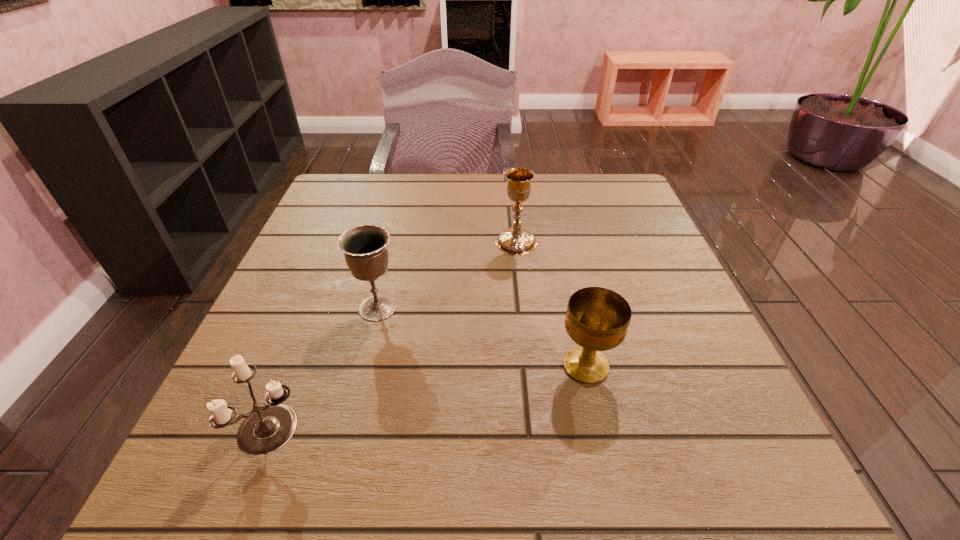
Where is `free location at the far right corner`? This screenshot has width=960, height=540. free location at the far right corner is located at coordinates coord(570,180).

At what (x,y) coordinates should I click in order to perform the action: click on vacant region at the near right corner of the desktop. Please return your answer as a coordinate pair (x, y). Looking at the image, I should click on (670, 460).

Where is `free spot between the farthest chalice and the second farthest object`? free spot between the farthest chalice and the second farthest object is located at coordinates (447, 275).

Identify the location of free area in between the candle holder and the third farthest object. This screenshot has width=960, height=540. (429, 397).

Locate an element on the screen. free point between the second object from right to left and the second nearest object is located at coordinates (551, 304).

Where is `free space between the second nearest object and the third object from right to left`? Image resolution: width=960 pixels, height=540 pixels. free space between the second nearest object and the third object from right to left is located at coordinates (482, 337).

This screenshot has width=960, height=540. I want to click on free space between the second object from right to left and the rightmost object, so click(551, 304).

Where is `empty location between the candle holder and the second farthest object`? empty location between the candle holder and the second farthest object is located at coordinates (324, 368).

Find the location of a particular element. Image resolution: width=960 pixels, height=540 pixels. vacant point located between the second nearest chalice and the shortest chalice is located at coordinates (482, 337).

Locate an element on the screen. The height and width of the screenshot is (540, 960). vacant area that lies between the candle holder and the third object from right to left is located at coordinates (324, 368).